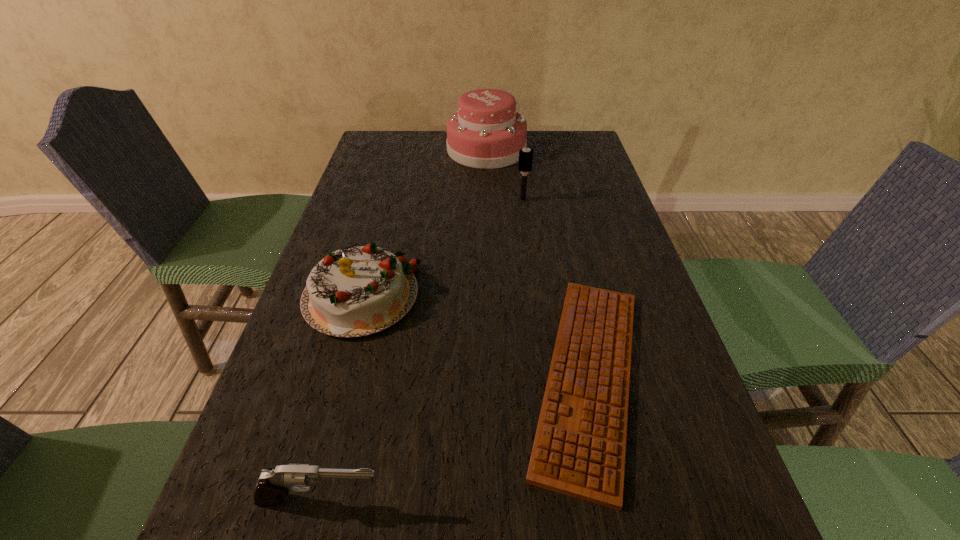
This screenshot has height=540, width=960. In the image, there is a desktop. What are the coordinates of `free space at the far right corner` in the screenshot? It's located at (591, 143).

Image resolution: width=960 pixels, height=540 pixels. In order to click on free area in between the nearer cake and the gun in this screenshot , I will do `click(341, 399)`.

Image resolution: width=960 pixels, height=540 pixels. Identify the location of vacant area that lies between the taller cake and the shorter cake. (423, 223).

Where is `free space between the shortest object and the farther cake`? This screenshot has width=960, height=540. free space between the shortest object and the farther cake is located at coordinates (538, 262).

Locate an element on the screen. The height and width of the screenshot is (540, 960). free area in between the shorter cake and the hairbrush is located at coordinates (442, 248).

This screenshot has width=960, height=540. Find the location of `free area in between the taller cake and the gun`. free area in between the taller cake and the gun is located at coordinates (403, 325).

I want to click on free area in between the shortest object and the fourth tallest object, so click(x=455, y=438).

What are the coordinates of `vacant area that lies between the fourth tallest object and the fourth nearest object` in the screenshot? It's located at (421, 350).

Identify the location of unoccupied area between the computer keyboard and the shorter cake. (475, 336).

The width and height of the screenshot is (960, 540). I want to click on free space between the computer keyboard and the shorter cake, so click(x=475, y=336).